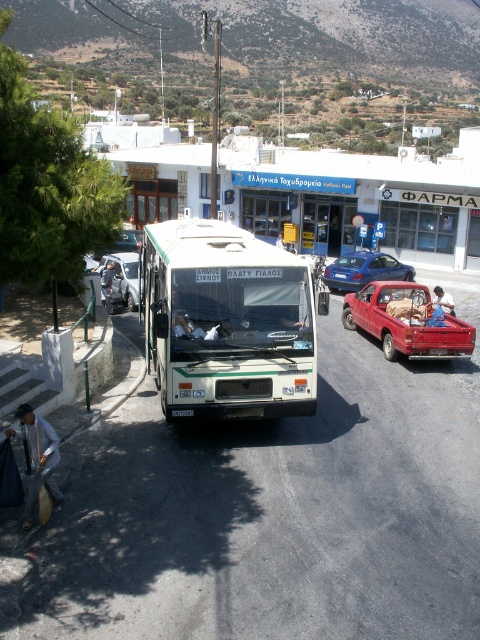
You are a pedestrian standing at the edge of the road where the white matte tour bus at center and blue metallic sedan at center are parked. You need to cross the road to reach the post office. Is there enough space between the two vehicles to safely cross without stepping into the road lane?

The distance between the white matte tour bus at center and blue metallic sedan at center is 13.36 meters, which is more than enough space to safely cross the road between them without entering the road lane.